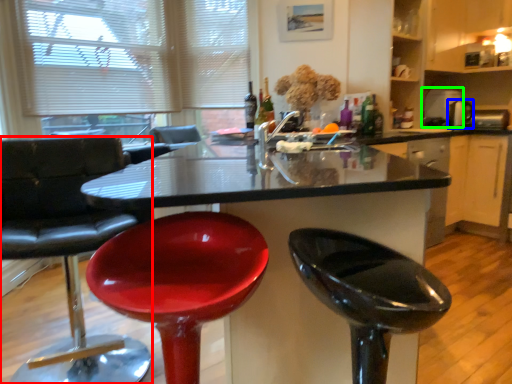
Question: Which object is the farthest from chair (highlighted by a red box)? Choose among these: appliance (highlighted by a blue box) or appliance (highlighted by a green box).

Choices:
 (A) appliance
 (B) appliance

Answer: (A)